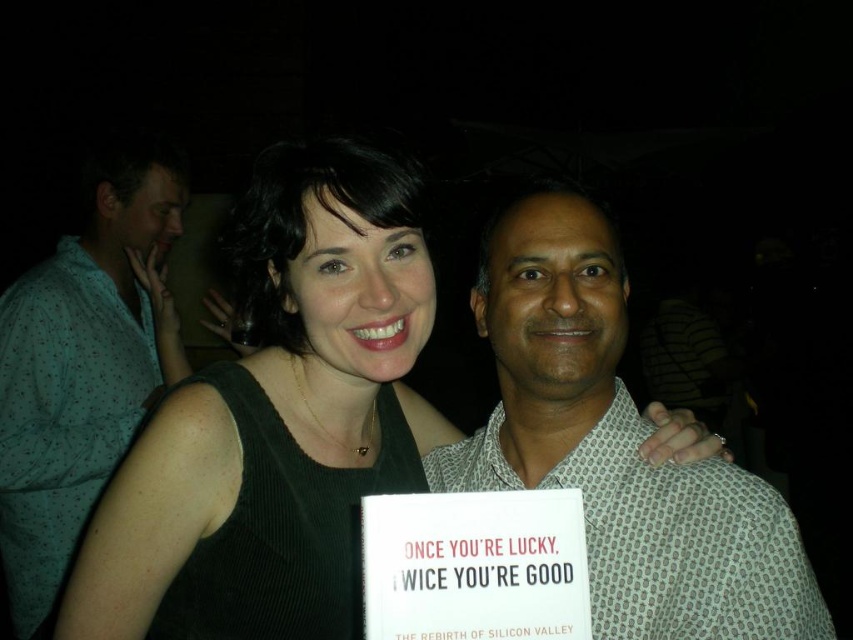
Does black fabric dress at center have a lesser width compared to green dotted shirt at left?

In fact, black fabric dress at center might be wider than green dotted shirt at left.

Does point (259, 636) come behind point (96, 408)?

That is False.

Find the location of a particular element. The image size is (853, 640). black fabric dress at center is located at coordinates (274, 416).

Measure the distance from white dotted shirt at center to green dotted shirt at left.

1.14 meters

Does white dotted shirt at center appear on the right side of green dotted shirt at left?

Yes, white dotted shirt at center is to the right of green dotted shirt at left.

This screenshot has height=640, width=853. Identify the location of white dotted shirt at center. (618, 445).

At what (x,y) coordinates should I click in order to perform the action: click on white dotted shirt at center. Please return your answer as a coordinate pair (x, y). The image size is (853, 640). Looking at the image, I should click on (618, 445).

Based on the photo, is green dotted shirt at left bigger than white paper sign at center?

Yes.

Who is more forward, (136, 333) or (572, 634)?

Point (572, 634) is in front.

At what (x,y) coordinates should I click in order to perform the action: click on green dotted shirt at left. Please return your answer as a coordinate pair (x, y). This screenshot has width=853, height=640. Looking at the image, I should click on (83, 364).